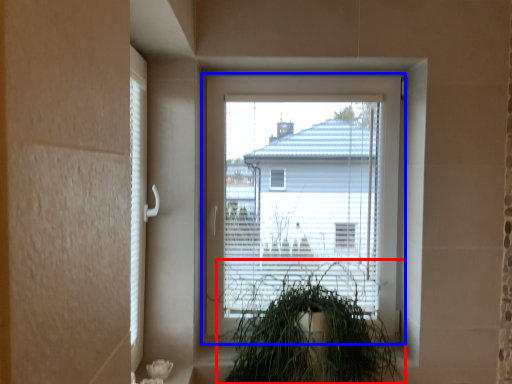
Question: Which object is closer to the camera taking this photo, houseplant (highlighted by a red box) or window (highlighted by a blue box)?

Choices:
 (A) houseplant
 (B) window

Answer: (A)